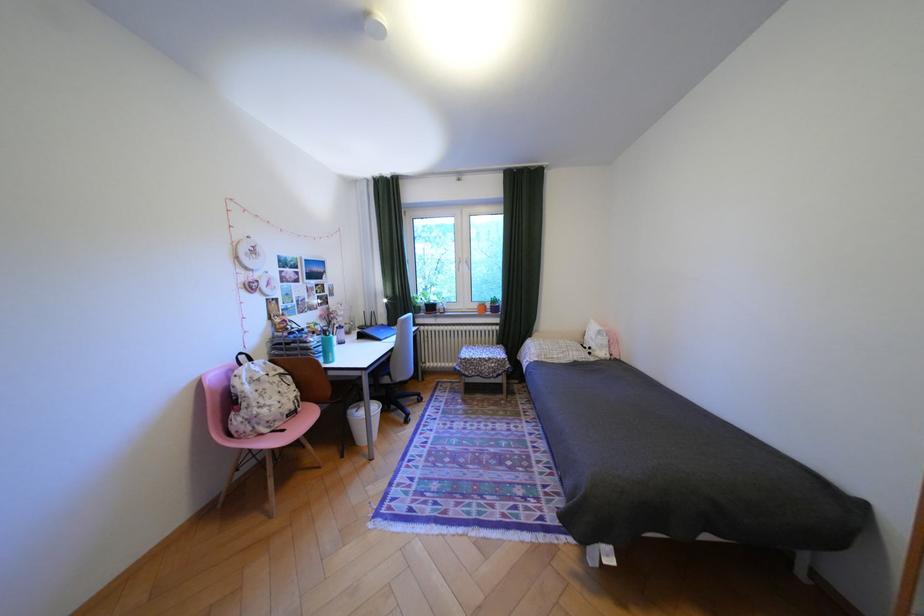
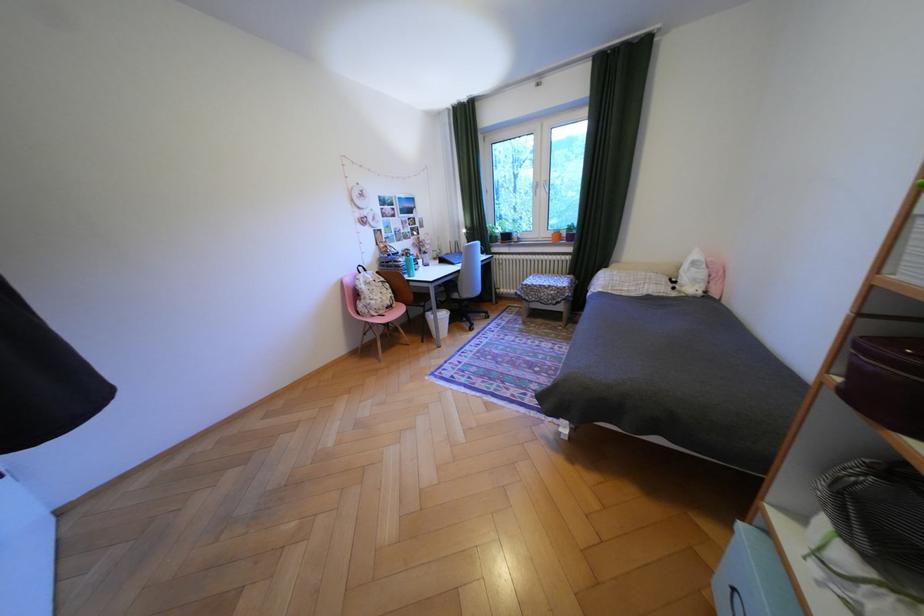
In the second image, find the point that corresponds to point (502, 359) in the first image.

(562, 286)